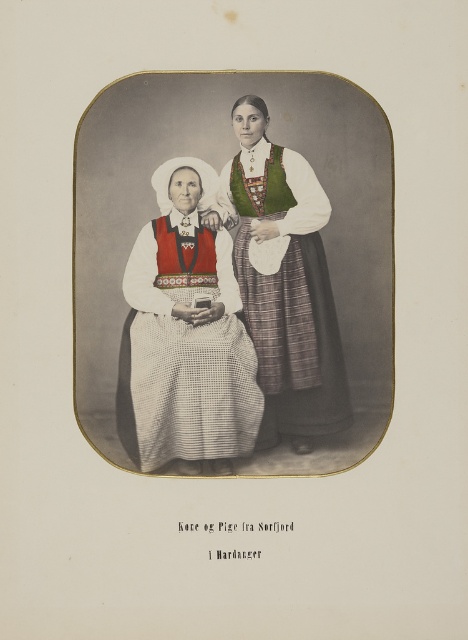
Question: Is knitted fabric dress at left positioned at the back of green woven blouse at center?

Choices:
 (A) yes
 (B) no

Answer: (B)

Question: Which point is farther to the camera?

Choices:
 (A) knitted fabric dress at left
 (B) green woven blouse at center

Answer: (B)

Question: Among these objects, which one is farthest from the camera?

Choices:
 (A) green woven blouse at center
 (B) knitted fabric dress at left

Answer: (A)

Question: Can you confirm if knitted fabric dress at left is positioned to the left of green woven blouse at center?

Choices:
 (A) no
 (B) yes

Answer: (B)

Question: Can you confirm if knitted fabric dress at left is positioned below green woven blouse at center?

Choices:
 (A) no
 (B) yes

Answer: (B)